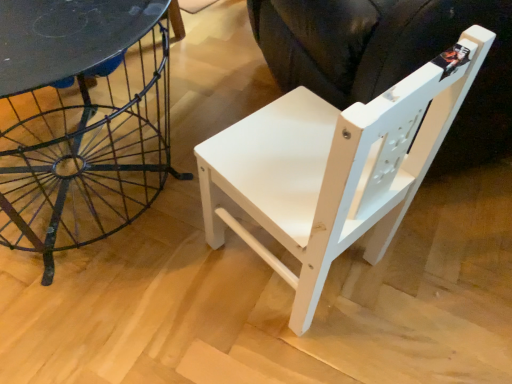
Question: Is point (x=377, y=249) positioned closer to the camera than point (x=49, y=26)?

Choices:
 (A) closer
 (B) farther

Answer: (B)

Question: From their relative heights in the image, would you say white matte wood chair at center is taller or shorter than matte black table at left?

Choices:
 (A) tall
 (B) short

Answer: (A)

Question: Based on their relative distances, which object is farther from the white matte wood swivel chair at center?

Choices:
 (A) metallic black table at left
 (B) white matte wood chair at center
 (C) matte black table at left

Answer: (A)

Question: Which object is the closest to the white matte wood swivel chair at center?

Choices:
 (A) metallic black table at left
 (B) matte black table at left
 (C) white matte wood chair at center

Answer: (C)